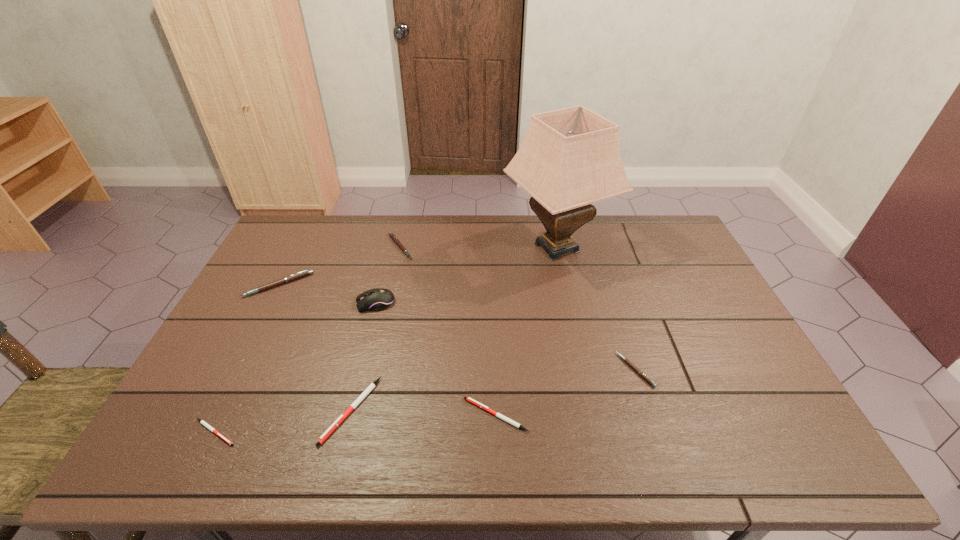
Identify the location of white pen that is the third nearest to the tallest object. (202, 422).

Where is `free location that satisfies the following two spatial constraints: 1. at the nib of the black computer mouse; 2. on the left side of the leftmost pink pen`? This screenshot has height=540, width=960. free location that satisfies the following two spatial constraints: 1. at the nib of the black computer mouse; 2. on the left side of the leftmost pink pen is located at coordinates (270, 303).

Where is `vacant space that satisfies the following two spatial constraints: 1. at the nib of the farthest pink pen; 2. at the nib of the second farthest pink pen`? The height and width of the screenshot is (540, 960). vacant space that satisfies the following two spatial constraints: 1. at the nib of the farthest pink pen; 2. at the nib of the second farthest pink pen is located at coordinates (392, 285).